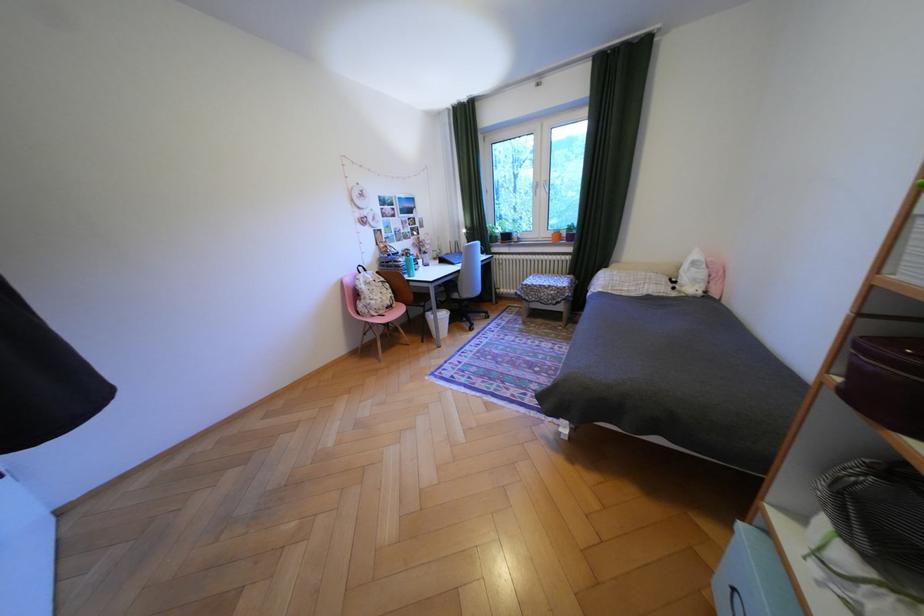
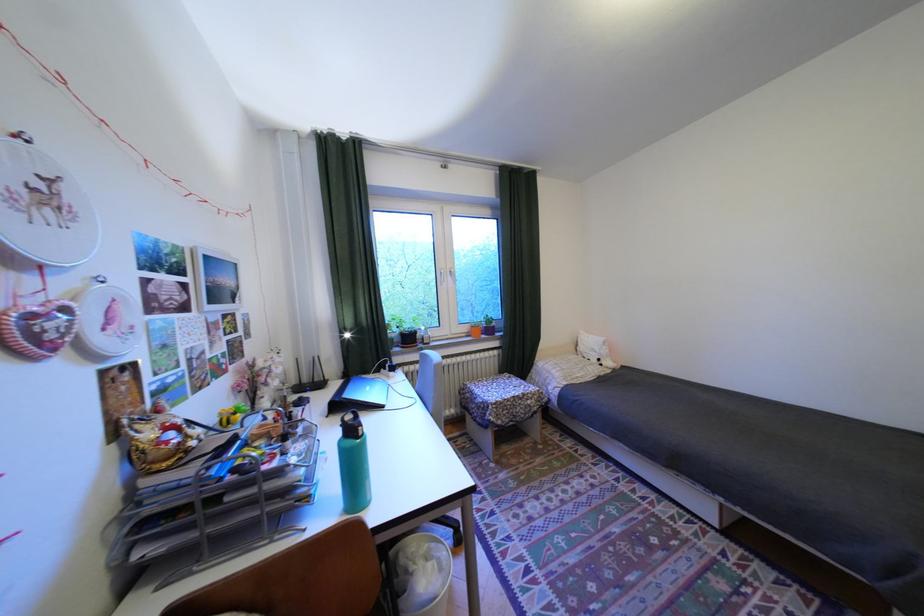
The point at (539, 299) is marked in the first image. Where is the corresponding point in the second image?

(512, 422)